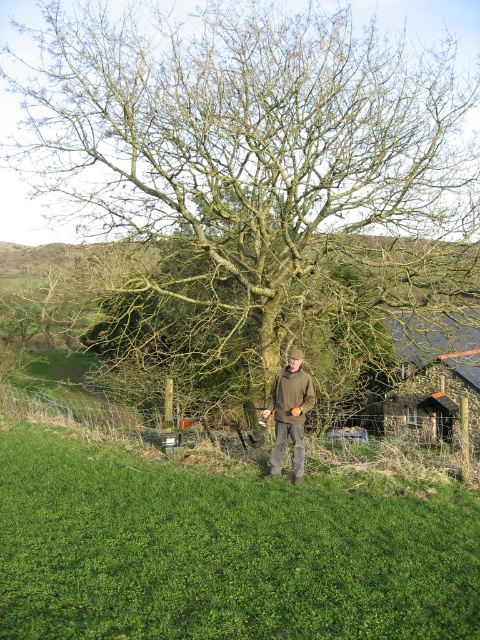
Based on the photo, you are a traveler who wants to take a photo of both the green rough bark tree at center and the stone slate roof hut at right. Since you can only focus on one object at a time, which object should you focus on to ensure the other is still in the background?

The green rough bark tree at center is positioned on the left side of stone slate roof hut at right, so you should focus on the stone slate roof hut at right to have the green rough bark tree at center in the background.

You are a hiker trying to take a photo of the stone slate roof hut at right. You notice the green rough bark tree at center is blocking your view. Can you move to the left or right to avoid the tree?

Since the green rough bark tree at center is closer to you than the stone slate roof hut at right, you can move to the right to position yourself so that the tree no longer blocks the view of the stone slate roof hut at right.

You are a photographer aiming to capture a shot of the green grassy at center and the brown woolen jacket at center. Based on their positions, which one is located lower in the image?

The green grassy at center is located lower in the image because it is positioned below the brown woolen jacket at center.